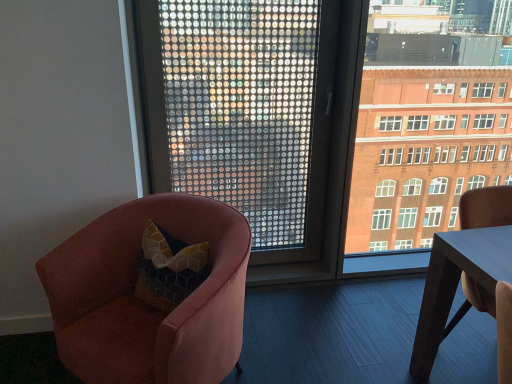
Question: Based on their sizes in the image, would you say velvet pink armchair at left is bigger or smaller than smooth wooden table at right?

Choices:
 (A) big
 (B) small

Answer: (A)

Question: Is velvet pink armchair at left in front of or behind smooth wooden table at right in the image?

Choices:
 (A) front
 (B) behind

Answer: (A)

Question: Estimate the real-world distances between objects in this image. Which object is farther from the brick building at right?

Choices:
 (A) velvet pink armchair at left
 (B) transparent glass window at center
 (C) smooth wooden table at right

Answer: (A)

Question: Based on their relative distances, which object is nearer to the smooth wooden table at right?

Choices:
 (A) brick building at right
 (B) velvet pink armchair at left
 (C) transparent glass window at center

Answer: (A)